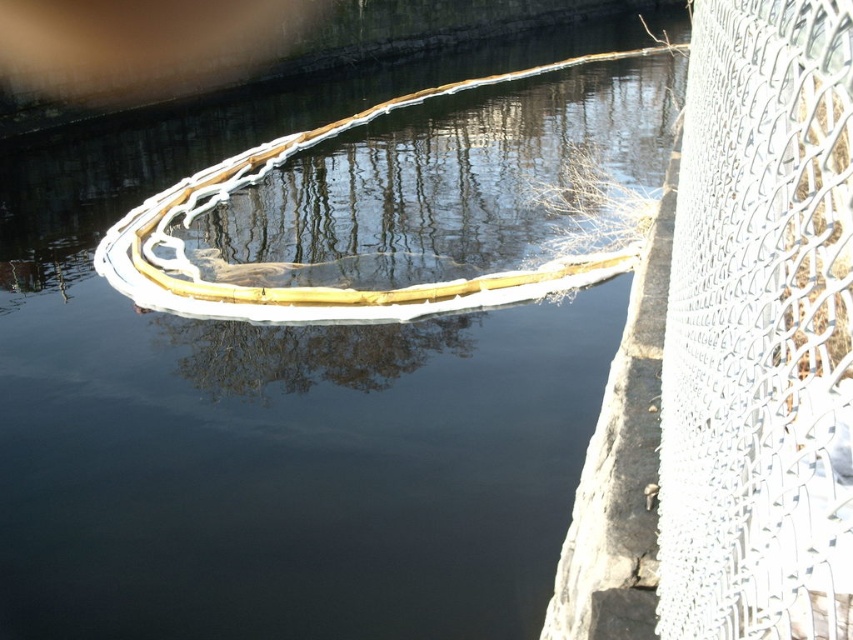
Does white wire mesh fence at right appear on the left side of wooden boat at center?

Indeed, white wire mesh fence at right is positioned on the left side of wooden boat at center.

Which is more to the left, white wire mesh fence at right or wooden boat at center?

Positioned to the left is white wire mesh fence at right.

Image resolution: width=853 pixels, height=640 pixels. What are the coordinates of `white wire mesh fence at right` in the screenshot? It's located at (759, 330).